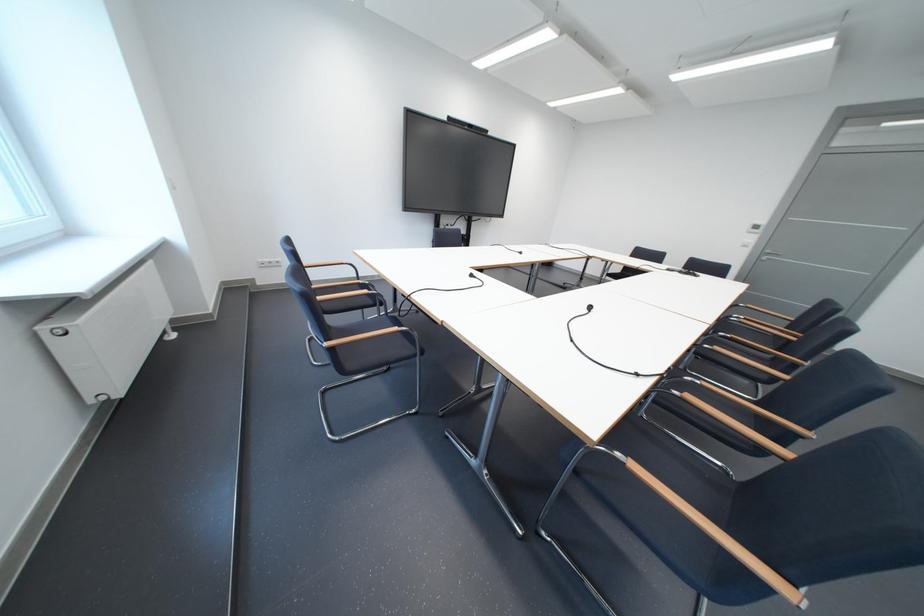
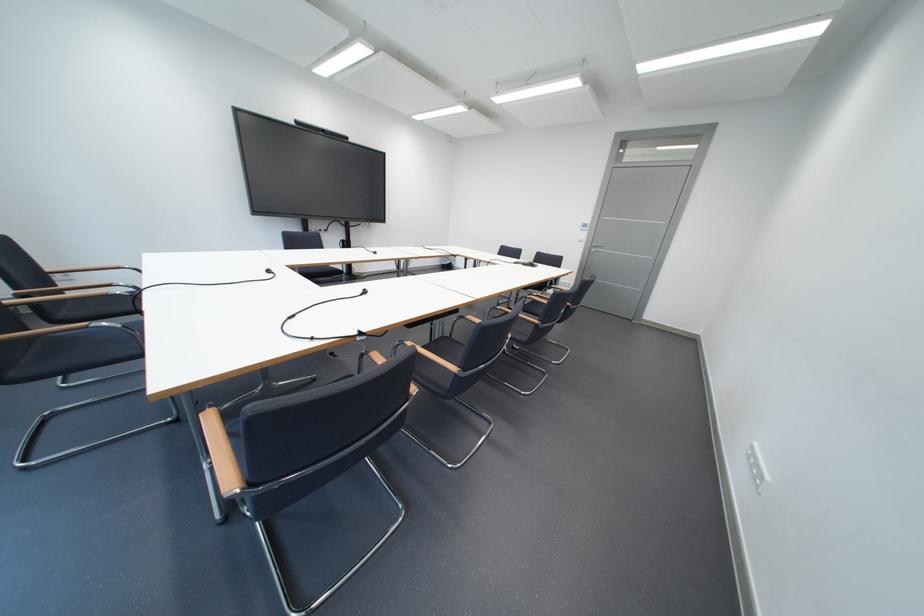
Locate, in the second image, the point that corresponds to (336,308) in the first image.

(74, 317)